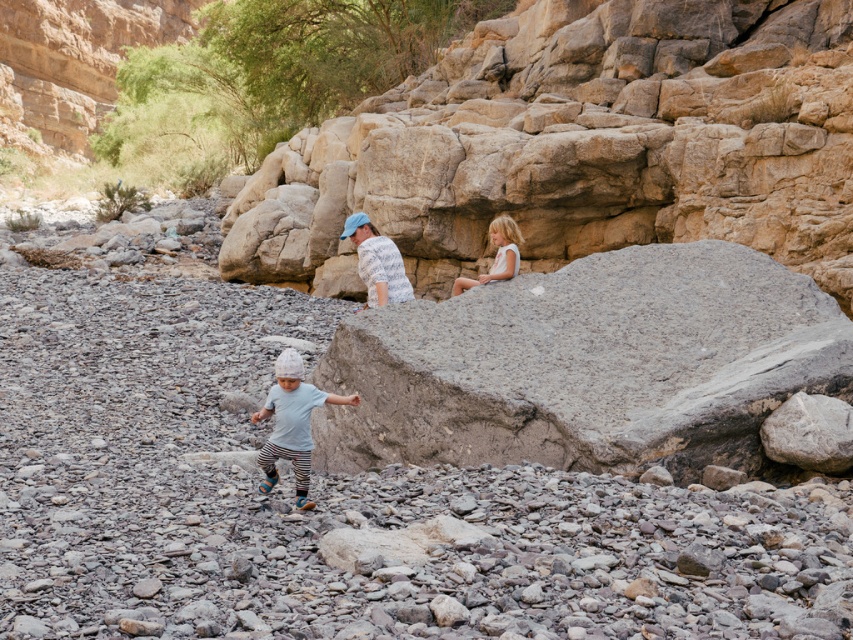
Question: Is gray gravel at center further to camera compared to gray rough boulder at center?

Choices:
 (A) no
 (B) yes

Answer: (A)

Question: Is the position of gray rough boulder at center more distant than that of light blue cotton shirt at center?

Choices:
 (A) yes
 (B) no

Answer: (A)

Question: Which point appears closest to the camera in this image?

Choices:
 (A) (505, 234)
 (B) (566, 321)
 (C) (294, 456)
 (D) (831, 250)

Answer: (C)

Question: Which of the following is the farthest from the observer?

Choices:
 (A) light blue cotton shirt at center
 (B) gray rough boulder at center
 (C) gray gravel at center

Answer: (B)

Question: Which object appears farthest from the camera in this image?

Choices:
 (A) light blue cotton shirt at center
 (B) blonde hair girl at upper right

Answer: (B)

Question: Is gray rough rock at center further to camera compared to gray rough boulder at center?

Choices:
 (A) no
 (B) yes

Answer: (B)